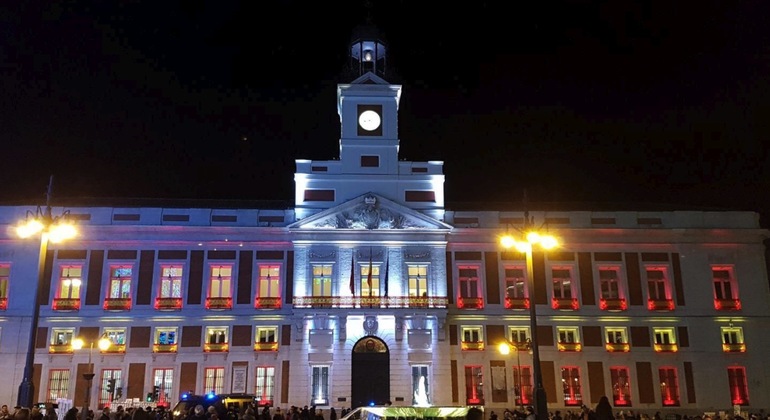
What are the coordinates of `doors` in the screenshot? It's located at (380, 378), (362, 377).